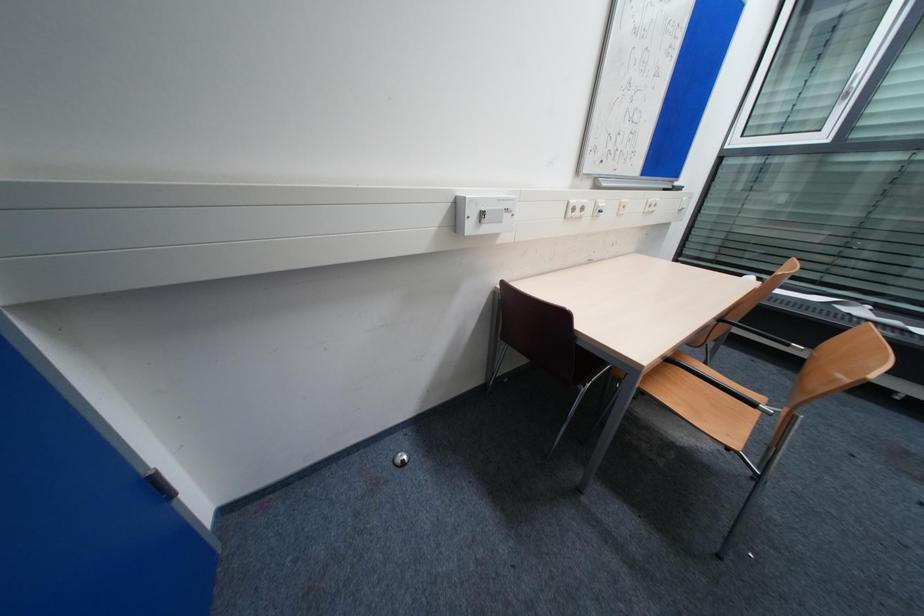
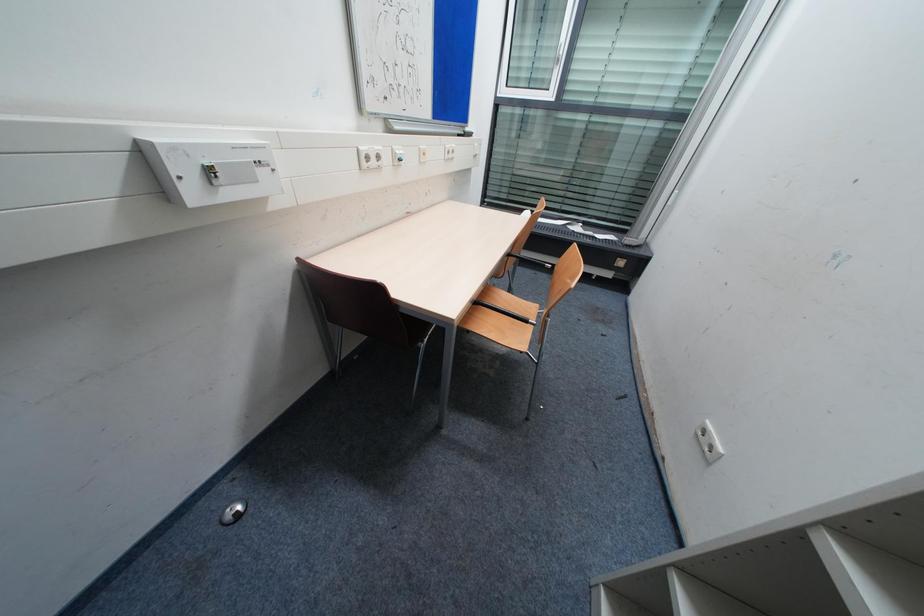
Question: The camera is either moving clockwise (left) or counter-clockwise (right) around the object. The first image is from the beginning of the video and the second image is from the end. Is the camera moving left or right when shooting the video?

Choices:
 (A) Left
 (B) Right

Answer: (A)